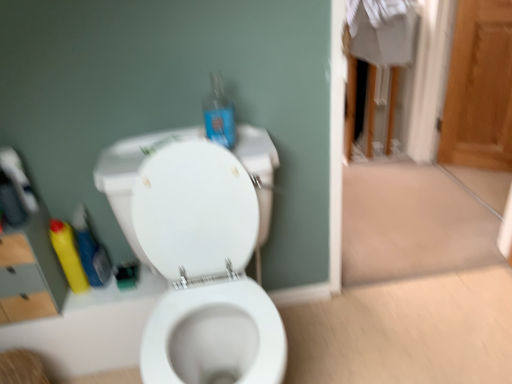
Question: Would you say yellow matte bottle at lower left, which ranks as the first cleaning product in left-to-right order, is inside or outside white glossy toilet at center?

Choices:
 (A) outside
 (B) inside

Answer: (A)

Question: Relative to white glossy toilet at center, is yellow matte bottle at lower left, the 2th cleaning product positioned from the right, in front or behind?

Choices:
 (A) behind
 (B) front

Answer: (A)

Question: Which is nearer to the translucent blue plastic bottle at upper center?

Choices:
 (A) wooden door at right
 (B) white glossy toilet at center
 (C) matte gray medicine cabinet at left
 (D) yellow matte bottle at lower left, the 2th cleaning product positioned from the right
 (E) yellow plastic bottle at left, which appears as the second cleaning product when viewed from the left

Answer: (B)

Question: Estimate the real-world distances between objects in this image. Which object is closer to the wooden door at right?

Choices:
 (A) yellow plastic bottle at left, the first cleaning product positioned from the right
 (B) white glossy toilet at center
 (C) yellow matte bottle at lower left, which ranks as the first cleaning product in left-to-right order
 (D) matte gray medicine cabinet at left
 (E) translucent blue plastic bottle at upper center

Answer: (E)